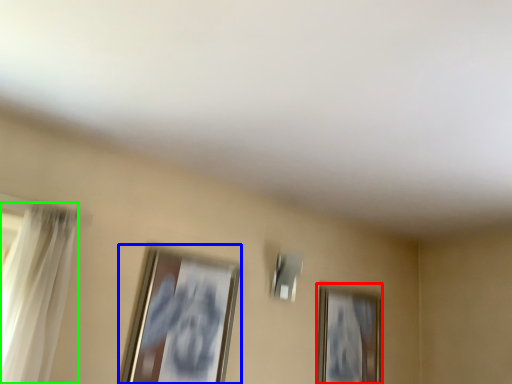
Question: Estimate the real-world distances between objects in this image. Which object is closer to picture frame (highlighted by a red box), picture frame (highlighted by a blue box) or curtain (highlighted by a green box)?

Choices:
 (A) picture frame
 (B) curtain

Answer: (A)